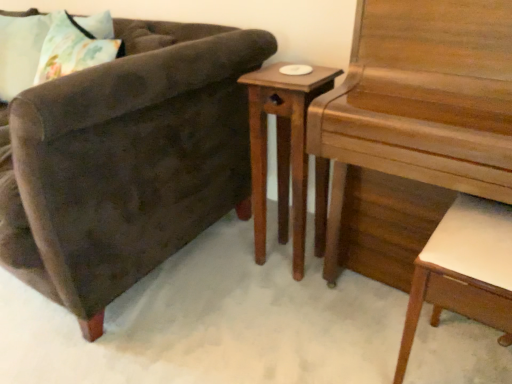
Question: Can you confirm if wooden nightstand at center is thinner than wooden piano at right?

Choices:
 (A) no
 (B) yes

Answer: (B)

Question: Is wooden nightstand at center smaller than wooden piano at right?

Choices:
 (A) no
 (B) yes

Answer: (B)

Question: From a real-world perspective, is wooden nightstand at center positioned under wooden piano at right based on gravity?

Choices:
 (A) yes
 (B) no

Answer: (A)

Question: Can you confirm if wooden nightstand at center is positioned to the left of wooden piano at right?

Choices:
 (A) yes
 (B) no

Answer: (A)

Question: Is wooden nightstand at center not near wooden piano at right?

Choices:
 (A) yes
 (B) no

Answer: (B)

Question: Is fluffy fabric pillow at upper left bigger or smaller than wooden piano at right?

Choices:
 (A) small
 (B) big

Answer: (A)

Question: Considering their positions, is fluffy fabric pillow at upper left located in front of or behind wooden piano at right?

Choices:
 (A) front
 (B) behind

Answer: (B)

Question: Visually, is fluffy fabric pillow at upper left positioned to the left or to the right of wooden piano at right?

Choices:
 (A) right
 (B) left

Answer: (B)

Question: Is fluffy fabric pillow at upper left wider or thinner than wooden piano at right?

Choices:
 (A) thin
 (B) wide

Answer: (A)

Question: Looking at the image, does wooden nightstand at center seem bigger or smaller compared to velvet brown armchair at left?

Choices:
 (A) big
 (B) small

Answer: (B)

Question: In terms of width, does wooden nightstand at center look wider or thinner when compared to velvet brown armchair at left?

Choices:
 (A) wide
 (B) thin

Answer: (B)

Question: Considering the positions of point (263, 84) and point (168, 112), is point (263, 84) closer or farther from the camera than point (168, 112)?

Choices:
 (A) farther
 (B) closer

Answer: (B)

Question: From a real-world perspective, is wooden nightstand at center physically located above or below velvet brown armchair at left?

Choices:
 (A) below
 (B) above

Answer: (A)

Question: Considering the relative positions of wooden piano at right and white leather desk at lower right in the image provided, is wooden piano at right to the left or to the right of white leather desk at lower right?

Choices:
 (A) right
 (B) left

Answer: (B)

Question: Considering the positions of wooden piano at right and white leather desk at lower right in the image, is wooden piano at right wider or thinner than white leather desk at lower right?

Choices:
 (A) thin
 (B) wide

Answer: (B)